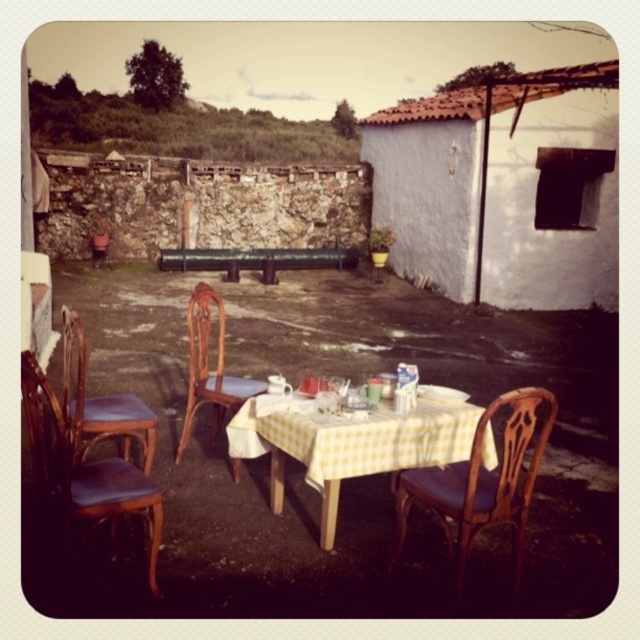
Does point (538, 230) lie in front of point (307, 440)?

That is False.

Can you confirm if white stucco hut at upper right is positioned to the left of yellow checkered tablecloth at center?

No, white stucco hut at upper right is not to the left of yellow checkered tablecloth at center.

Who is more distant from viewer, (513, 170) or (449, 440)?

Point (513, 170)

Find the location of a particular element. Image resolution: width=640 pixels, height=640 pixels. white stucco hut at upper right is located at coordinates 499,188.

This screenshot has width=640, height=640. Describe the element at coordinates (349, 444) in the screenshot. I see `yellow checkered tablecloth at center` at that location.

How much distance is there between yellow checkered tablecloth at center and brown leather chair at lower left?

4.42 feet

Identify the location of yellow checkered tablecloth at center. The image size is (640, 640). (349, 444).

Is point (64, 461) positioned behind point (109, 436)?

No, (64, 461) is closer to viewer.

Can you confirm if brown leather chair at lower left is wider than brown leather chair at left?

Correct, the width of brown leather chair at lower left exceeds that of brown leather chair at left.

Between point (40, 444) and point (76, 330), which one is positioned behind?

The point (76, 330) is more distant.

The image size is (640, 640). What are the coordinates of `brown leather chair at lower left` in the screenshot? It's located at (84, 468).